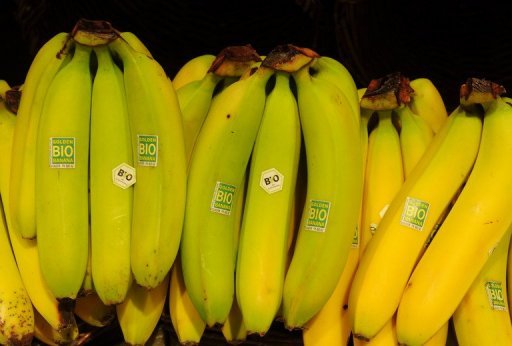
The width and height of the screenshot is (512, 346). Identify the location of sticker. (408, 211).